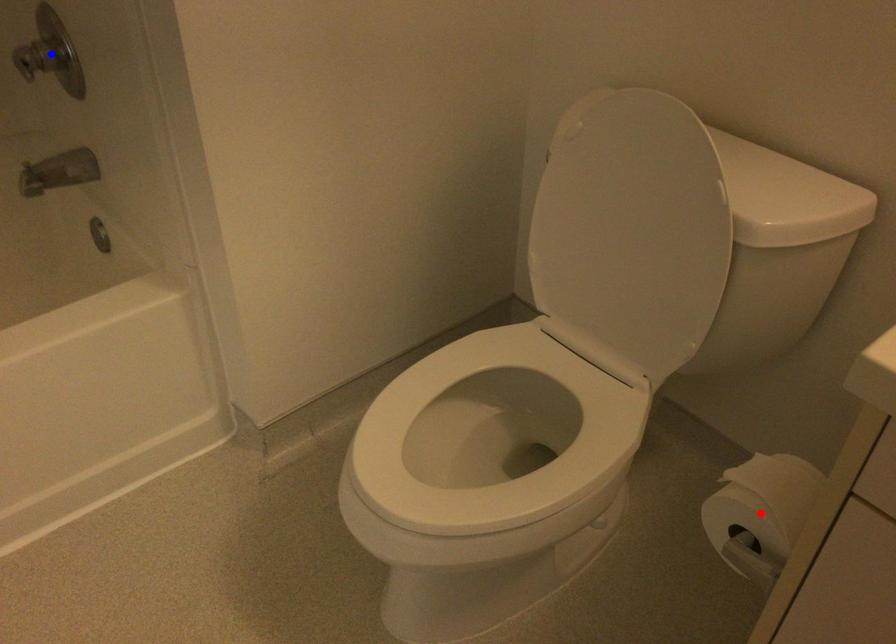
Question: Two points are marked on the image. Which point is closer to the camera?

Choices:
 (A) Blue point is closer.
 (B) Red point is closer.

Answer: (B)